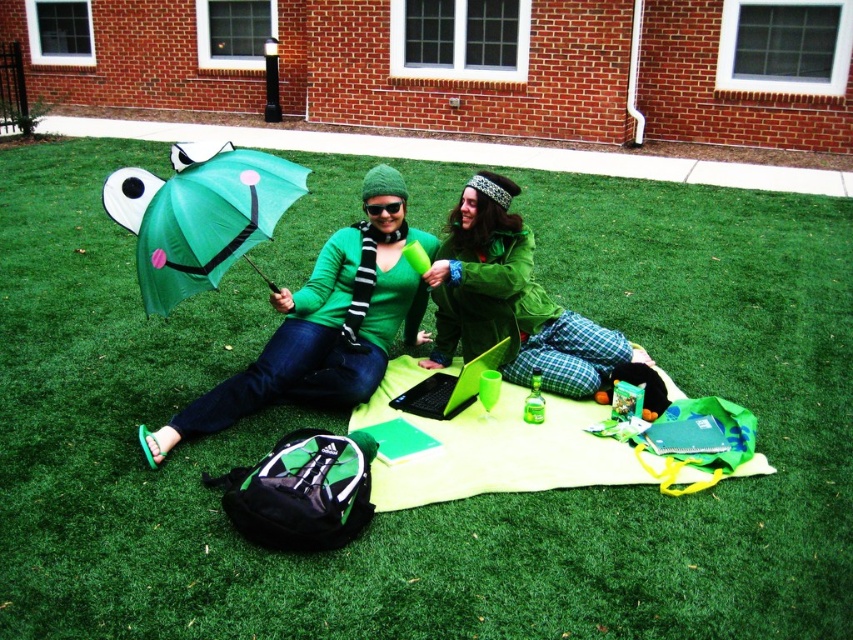
Question: Can you confirm if green fuzzy jacket at center is positioned above matte green umbrella at center?

Choices:
 (A) yes
 (B) no

Answer: (B)

Question: Considering the real-world distances, which object is farthest from the green fuzzy jacket at center?

Choices:
 (A) matte green umbrella at center
 (B) matte green umbrella at upper left

Answer: (A)

Question: Which object is positioned closest to the matte green umbrella at center?

Choices:
 (A) green fuzzy jacket at center
 (B) matte green umbrella at upper left

Answer: (B)

Question: Is green fuzzy jacket at center above matte green umbrella at center?

Choices:
 (A) no
 (B) yes

Answer: (A)

Question: Is matte green umbrella at upper left further to the viewer compared to green fuzzy jacket at center?

Choices:
 (A) yes
 (B) no

Answer: (B)

Question: Which of these objects is positioned farthest from the green fuzzy jacket at center?

Choices:
 (A) matte green umbrella at upper left
 (B) matte green umbrella at center

Answer: (B)